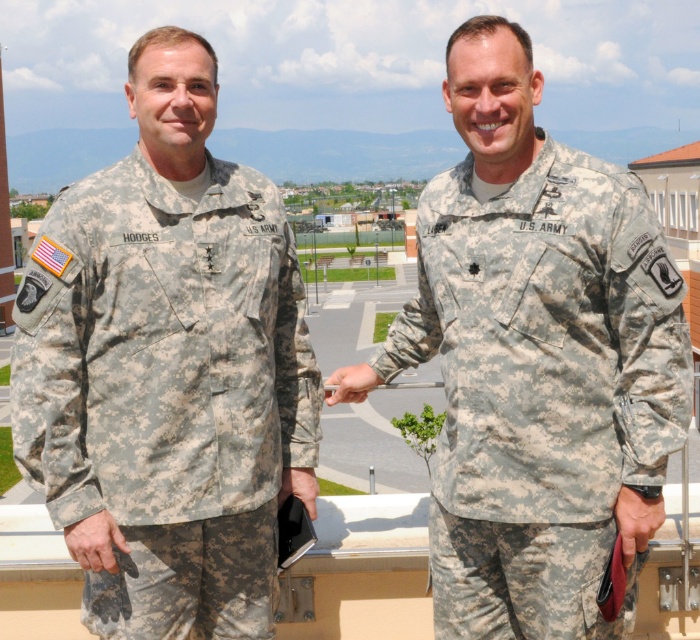
Question: Is camouflage fabric uniform at left further to camera compared to camouflage fabric uniform at right?

Choices:
 (A) yes
 (B) no

Answer: (B)

Question: Which point appears farthest from the camera in this image?

Choices:
 (A) (480, 266)
 (B) (183, 552)

Answer: (B)

Question: Does camouflage fabric uniform at left have a smaller size compared to camouflage fabric uniform at right?

Choices:
 (A) no
 (B) yes

Answer: (B)

Question: Can you confirm if camouflage fabric uniform at left is bigger than camouflage fabric uniform at right?

Choices:
 (A) no
 (B) yes

Answer: (A)

Question: Which of the following is the farthest from the observer?

Choices:
 (A) coord(92,348)
 (B) coord(421,257)

Answer: (B)